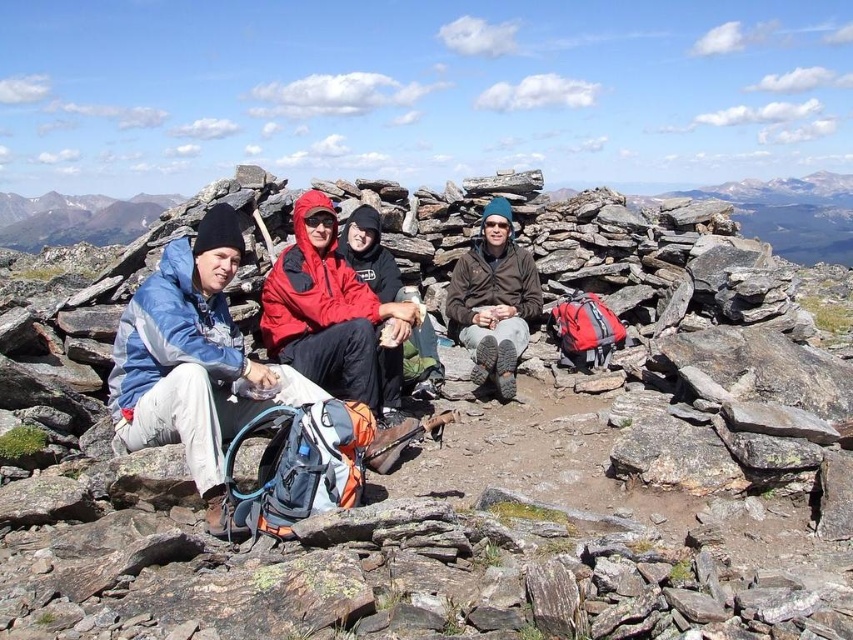
Is red nylon jacket at center above brown matte jacket at center?

No.

Is red nylon jacket at center wider than brown matte jacket at center?

Yes.

Does point (321, 278) lie in front of point (518, 323)?

Yes, it is.

Locate an element on the screen. The image size is (853, 640). red nylon jacket at center is located at coordinates (331, 314).

Who is shorter, rusty metal rock at center or red nylon jacket at center?

red nylon jacket at center

Is rusty metal rock at center shorter than red nylon jacket at center?

In fact, rusty metal rock at center may be taller than red nylon jacket at center.

Locate an element on the screen. rusty metal rock at center is located at coordinates (471, 476).

The height and width of the screenshot is (640, 853). In order to click on rusty metal rock at center in this screenshot , I will do `click(471, 476)`.

Can you confirm if rusty metal rock at center is wider than brown matte jacket at center?

Indeed, rusty metal rock at center has a greater width compared to brown matte jacket at center.

Does rusty metal rock at center have a lesser width compared to brown matte jacket at center?

Incorrect, rusty metal rock at center's width is not less than brown matte jacket at center's.

Is point (718, 436) positioned behind point (518, 248)?

No.

At what (x,y) coordinates should I click in order to perform the action: click on rusty metal rock at center. Please return your answer as a coordinate pair (x, y). This screenshot has height=640, width=853. Looking at the image, I should click on (471, 476).